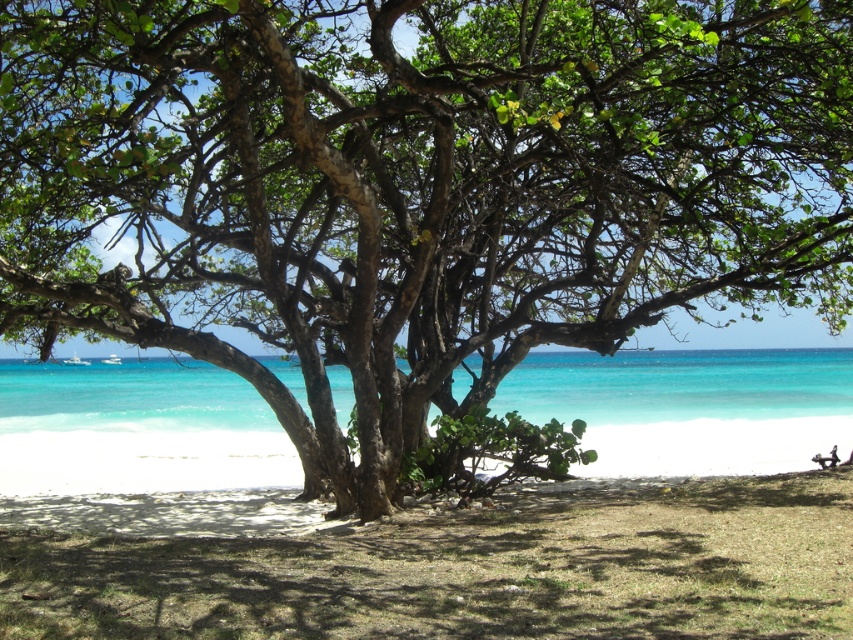
You are a beachgoer planning to set up a beach umbrella. You have two options for placement based on the available space. The first option is near the brown sand at center, and the second is near the turquoise water at center. Which location offers more horizontal space for your umbrella?

The turquoise water at center has a greater width than the brown sand at center, so the location near the turquoise water at center offers more horizontal space for the umbrella.

You are standing on the beach and see the brown sand at center and the turquoise water at center. Which one is located to the right of the other?

The brown sand at center is positioned on the right side of turquoise water at center.

You are standing on the beach and want to place a small flag exactly at the center of the brown sand at center. According to the coordinates provided, where should you place the flag?

You should place the flag at the coordinates point (x=469, y=570) on the brown sand at center.